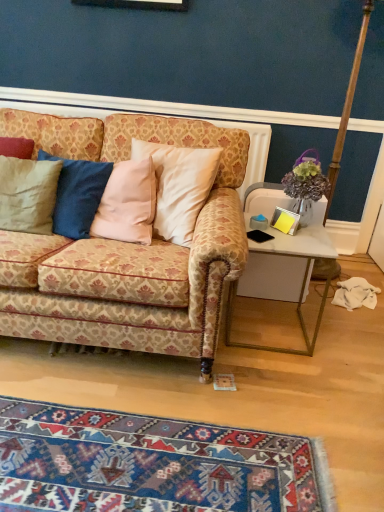
Question: Is matte beige pillow at left shorter than white glossy desk at right?

Choices:
 (A) yes
 (B) no

Answer: (A)

Question: Is matte beige pillow at left to the right of white glossy desk at right from the viewer's perspective?

Choices:
 (A) yes
 (B) no

Answer: (B)

Question: Considering the relative sizes of matte beige pillow at left and white glossy desk at right in the image provided, is matte beige pillow at left taller than white glossy desk at right?

Choices:
 (A) yes
 (B) no

Answer: (B)

Question: Can you confirm if matte beige pillow at left is bigger than white glossy desk at right?

Choices:
 (A) yes
 (B) no

Answer: (B)

Question: Does matte beige pillow at left lie behind white glossy desk at right?

Choices:
 (A) yes
 (B) no

Answer: (A)

Question: Is wooden pole at right spatially inside blue woven rug at lower center, or outside of it?

Choices:
 (A) outside
 (B) inside

Answer: (A)

Question: From a real-world perspective, is wooden pole at right positioned above or below blue woven rug at lower center?

Choices:
 (A) below
 (B) above

Answer: (B)

Question: Is wooden pole at right wider or thinner than blue woven rug at lower center?

Choices:
 (A) thin
 (B) wide

Answer: (B)

Question: Does point (364, 10) appear closer or farther from the camera than point (125, 413)?

Choices:
 (A) farther
 (B) closer

Answer: (A)

Question: Considering the positions of white glossy desk at right and blue woven rug at lower center in the image, is white glossy desk at right bigger or smaller than blue woven rug at lower center?

Choices:
 (A) big
 (B) small

Answer: (A)

Question: Is point (294, 234) positioned closer to the camera than point (218, 493)?

Choices:
 (A) farther
 (B) closer

Answer: (A)

Question: From a real-world perspective, is white glossy desk at right above or below blue woven rug at lower center?

Choices:
 (A) below
 (B) above

Answer: (B)

Question: From the image's perspective, is white glossy desk at right located above or below blue woven rug at lower center?

Choices:
 (A) below
 (B) above

Answer: (B)

Question: Is point (354, 76) closer or farther from the camera than point (36, 164)?

Choices:
 (A) farther
 (B) closer

Answer: (A)

Question: From the image's perspective, is wooden pole at right positioned above or below matte beige pillow at left?

Choices:
 (A) above
 (B) below

Answer: (A)